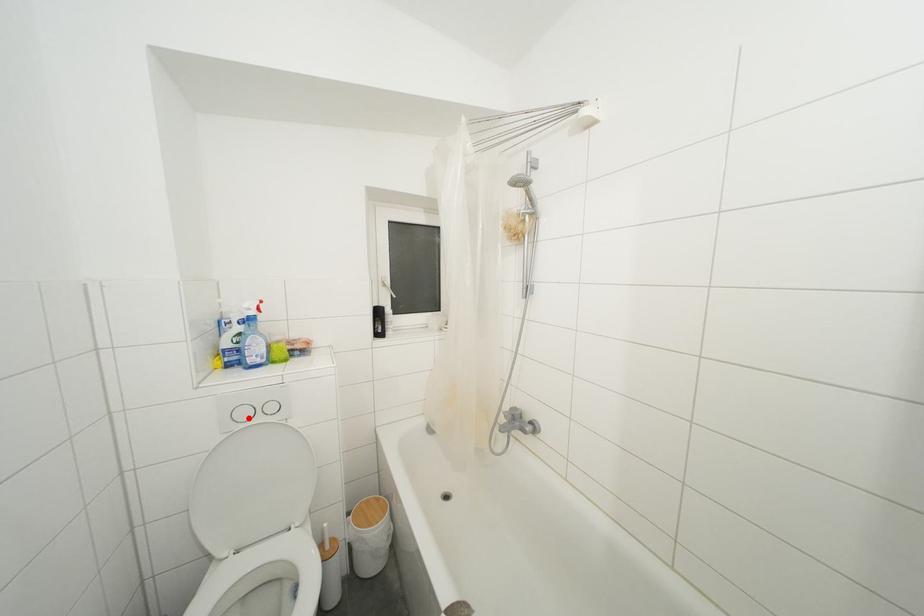
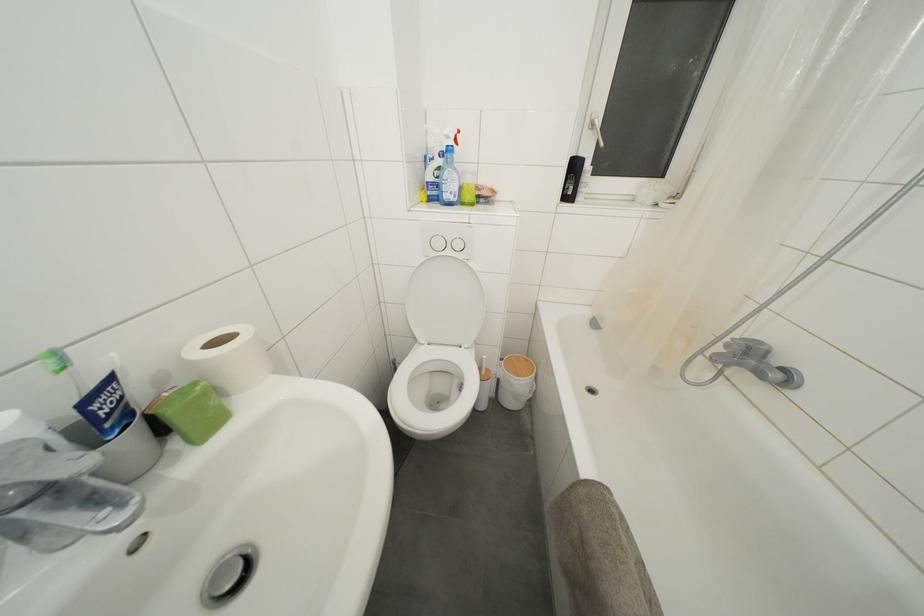
Where in the second image is the point corresponding to the highlighted location from the first image?

(443, 249)